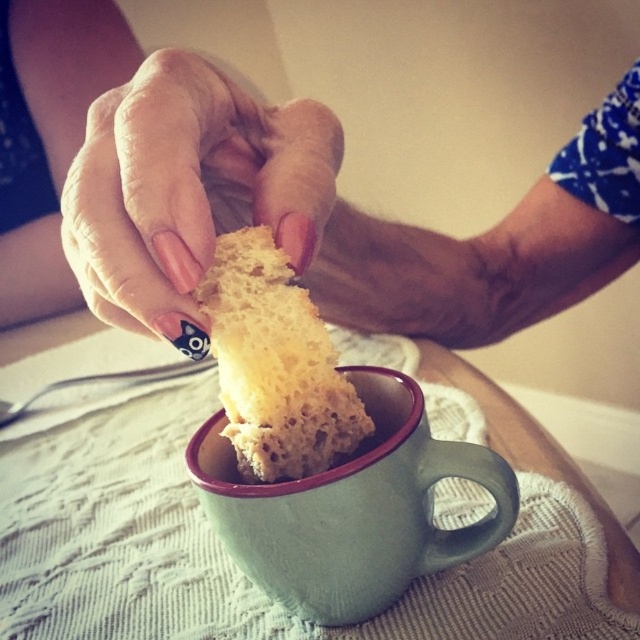
You are a baker observing the scene and need to place both the matte white bread at upper center and the spongy yellow bread at center into an oven. Which bread should you place first to ensure both bake evenly?

The matte white bread at upper center is in front of the spongy yellow bread at center, so you should place the spongy yellow bread at center first into the oven to ensure both bake evenly.

You are a barista preparing a drink and need to place both the green matte mug at center and the spongy yellow bread at center on a shelf. The shelf has a height limit of 12 centimeters. Can both items fit vertically on the shelf without exceeding the height limit?

The green matte mug at center has a greater height compared to spongy yellow bread at center. Since the shelf has a height limit of 12 centimeters, both items can fit vertically if the mug is the taller one and its height is under 12 cm. However, without knowing the exact height of the mug, we cannot confirm. But according to the description, the mug is taller than the bread. If the bread is under 12 cm, the mug might exceed the limit. The answer depends on the mug not exceeding 12 cm.

You are a chef observing a baking competition. You notice two items in the image provided. One is the nail polish painted fingernails at upper center and the other is the spongy yellow bread at center. Based on their sizes, which item would require more counter space if placed on a baking tray?

The nail polish painted fingernails at upper center is larger in size than the spongy yellow bread at center, so it would require more counter space if placed on a baking tray.